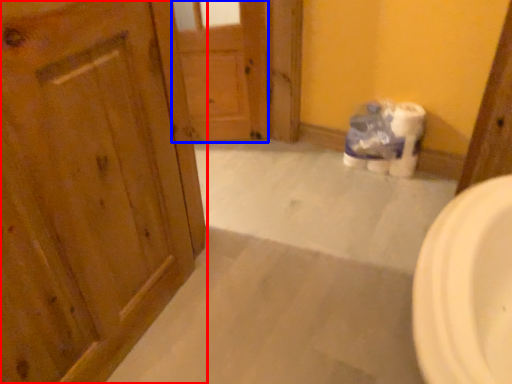
Question: Which of the following is the closest to the observer, door (highlighted by a red box) or door (highlighted by a blue box)?

Choices:
 (A) door
 (B) door

Answer: (A)